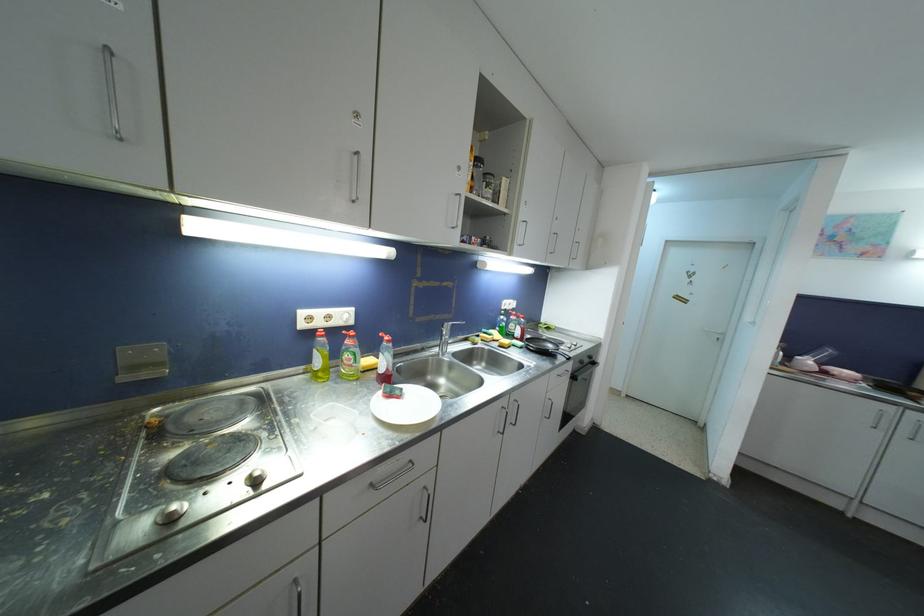
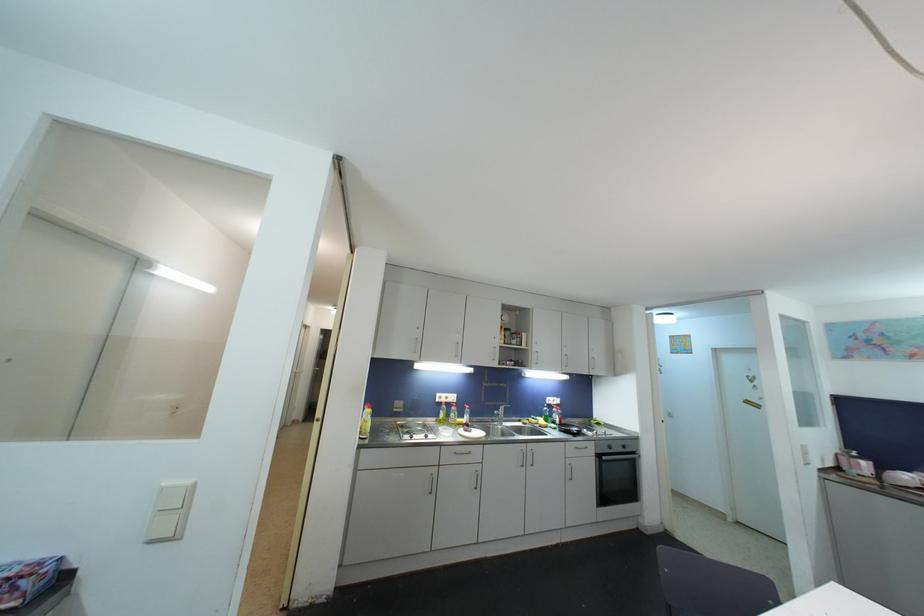
Where in the second image is the point corresponding to (332,320) from the first image?

(450, 400)